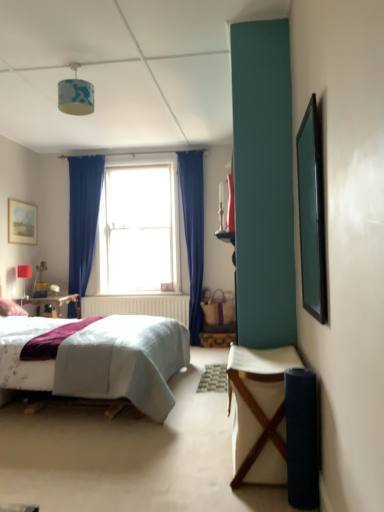
Question: Relative to white fabric desk at lower right, is brown woven picnic basket at center-right in front or behind?

Choices:
 (A) behind
 (B) front

Answer: (A)

Question: In the image, is brown woven picnic basket at center-right on the left side or the right side of white fabric desk at lower right?

Choices:
 (A) right
 (B) left

Answer: (B)

Question: Estimate the real-world distances between objects in this image. Which object is farther from the brown woven picnic basket at center-right?

Choices:
 (A) matte red lampshade at upper left, which is counted as the first lamp, starting from the bottom
 (B) blue fabric lampshade at upper center, the first lamp when ordered from right to left
 (C) white fabric desk at lower right
 (D) wooden stool at center
 (E) matte wooden picture frame at upper left, the first picture frame in the left-to-right sequence

Answer: (C)

Question: Considering the real-world distances, which object is farthest from the brown woven picnic basket at center-right?

Choices:
 (A) wooden stool at center
 (B) matte wooden picture frame at upper left, the 2th picture frame positioned from the right
 (C) matte red lampshade at upper left, which is the 2th lamp in right-to-left order
 (D) green matte picture frame at right, which is the first picture frame in right-to-left order
 (E) clear glass window at center

Answer: (D)